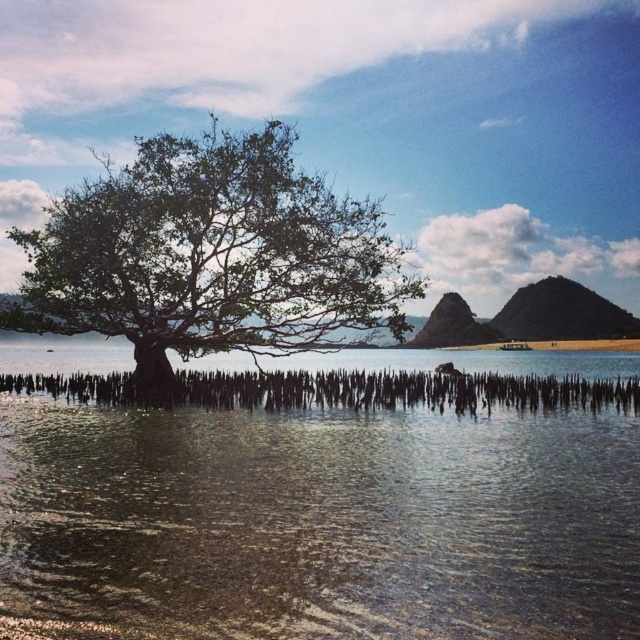
Question: Observing the image, what is the correct spatial positioning of clear water at center in reference to green leafy tree at center?

Choices:
 (A) left
 (B) right

Answer: (B)

Question: Which object is farther from the camera taking this photo?

Choices:
 (A) green leafy tree at center
 (B) clear water at center

Answer: (A)

Question: Which point is closer to the camera taking this photo?

Choices:
 (A) (168, 173)
 (B) (104, 468)

Answer: (B)

Question: Does clear water at center have a smaller size compared to green leafy tree at center?

Choices:
 (A) yes
 (B) no

Answer: (A)

Question: Which point is farther to the camera?

Choices:
 (A) green leafy tree at center
 (B) clear water at center

Answer: (A)

Question: Is clear water at center to the right of green leafy tree at center from the viewer's perspective?

Choices:
 (A) yes
 (B) no

Answer: (A)